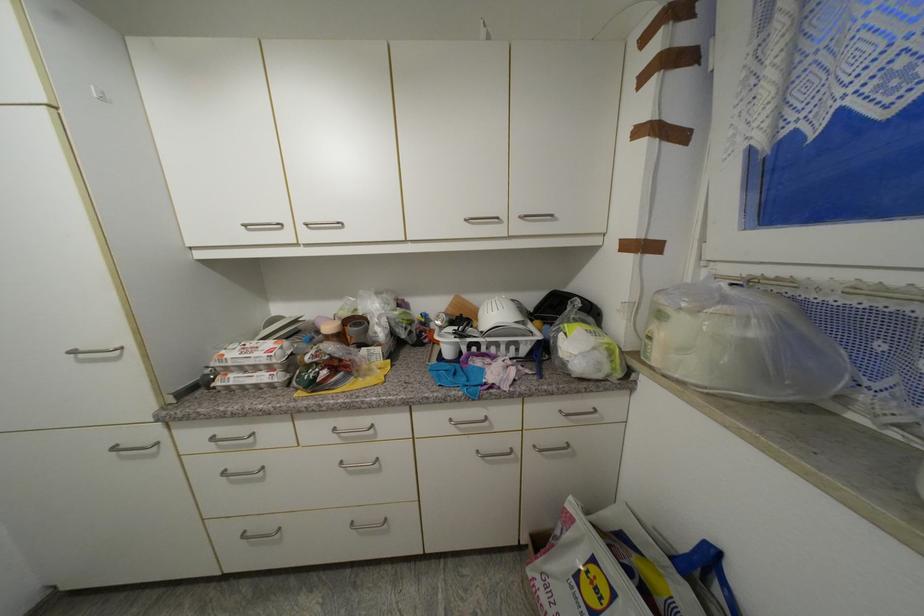
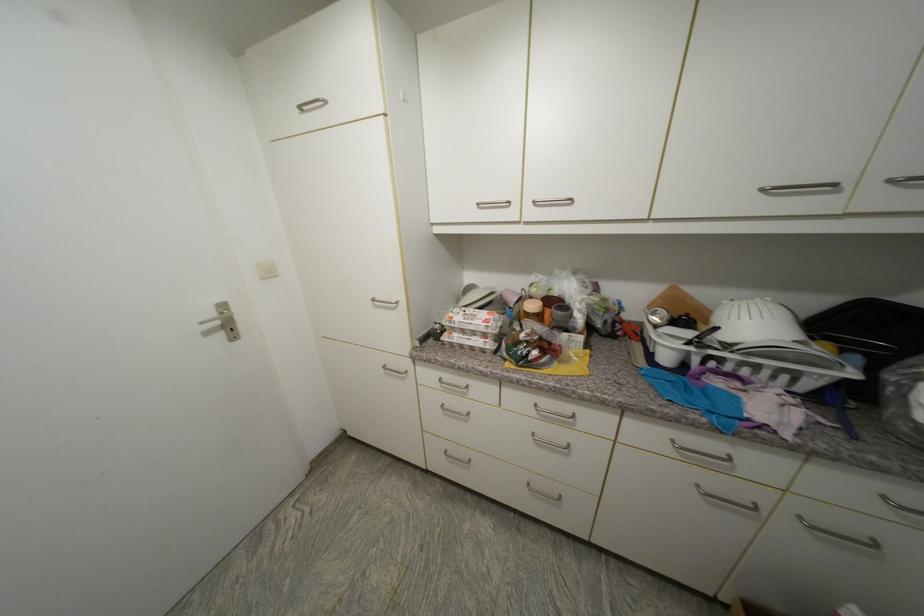
Locate, in the second image, the point that corresponds to point (228, 357) in the first image.

(457, 318)